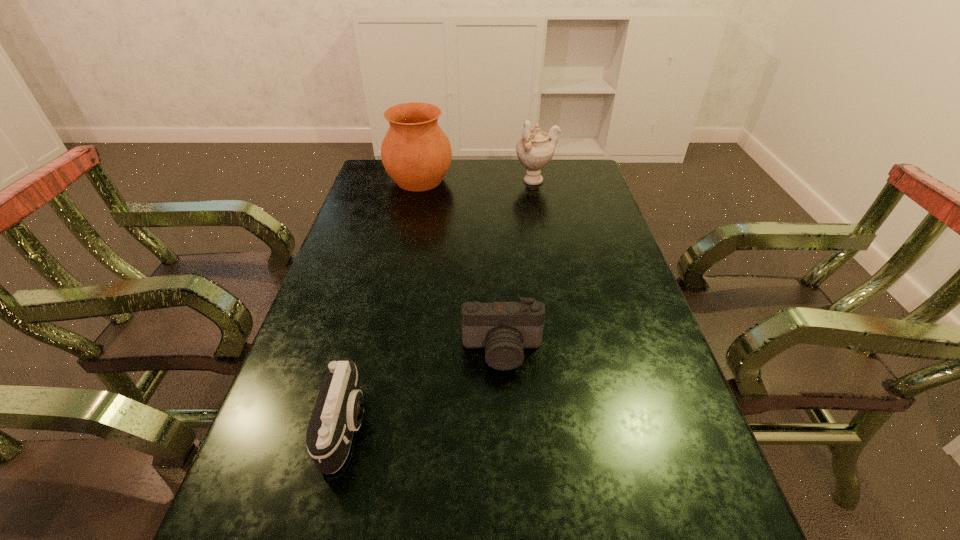
Where is `pottery`? pottery is located at coordinates (416, 153).

Identify the location of the third shortest object. The width and height of the screenshot is (960, 540). (536, 148).

The image size is (960, 540). Find the location of `the nearer camera`. the nearer camera is located at coordinates (338, 412).

Locate an element on the screen. The width and height of the screenshot is (960, 540). the left camera is located at coordinates (338, 412).

You are a GUI agent. You are given a task and a screenshot of the screen. Output one action in this format:
    pyautogui.click(x=<x>, y=<y>)
    Task: Click on the third farthest object
    The height and width of the screenshot is (540, 960).
    Given the screenshot: What is the action you would take?
    pyautogui.click(x=504, y=328)

Where is `the farther camera`? the farther camera is located at coordinates (504, 328).

Locate an element on the screen. vacant region located 0.400m on the right of the pottery is located at coordinates (564, 180).

Where is `free location located on the left of the urn`? free location located on the left of the urn is located at coordinates (465, 181).

I want to click on free region located on the front lens of the nearer camera, so click(x=559, y=427).

Locate an element on the screen. The width and height of the screenshot is (960, 540). vacant space situated at the lens of the third farthest object is located at coordinates (508, 465).